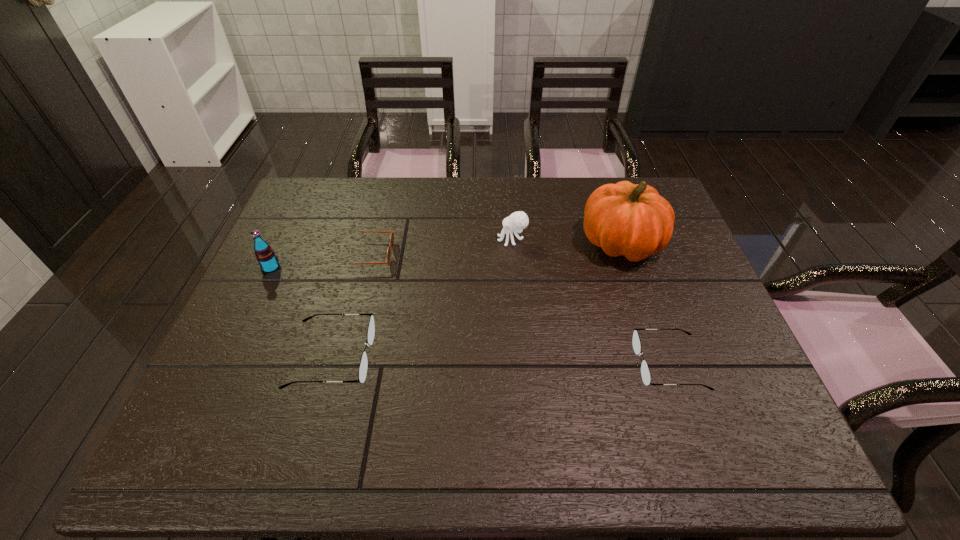
I want to click on free location located 0.200m on the lenses of the right spectacles, so click(550, 364).

The height and width of the screenshot is (540, 960). Identify the location of vacant region located 0.290m on the lenses of the right spectacles. (511, 364).

This screenshot has width=960, height=540. I want to click on vacant region located on the lenses of the right spectacles, so click(607, 364).

Identify the location of free point located on the front-facing side of the octopus. (457, 239).

Locate an element on the screen. The image size is (960, 540). free region located 0.370m on the front-facing side of the octopus is located at coordinates (373, 239).

Identify the location of free space located on the front-facing side of the octopus. The width and height of the screenshot is (960, 540). (380, 239).

I want to click on vacant region located on the back of the leftmost object, so click(298, 210).

Where is `vacant area situated 0.290m on the front-facing side of the sunglasses`? vacant area situated 0.290m on the front-facing side of the sunglasses is located at coordinates (493, 255).

Find the location of a particular element. The image size is (960, 540). free region located on the left of the tallest object is located at coordinates (521, 243).

Find the location of a particular element. object positioned at the far edge is located at coordinates (625, 219).